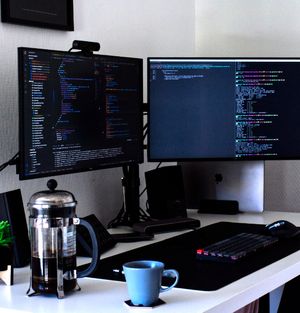
I want to click on desk mat, so click(x=174, y=251).